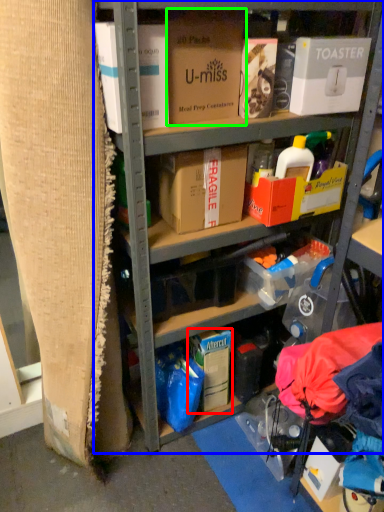
Question: Estimate the real-world distances between objects in this image. Which object is closer to storage box (highlighted by a red box), shelf (highlighted by a blue box) or box (highlighted by a green box)?

Choices:
 (A) shelf
 (B) box

Answer: (A)